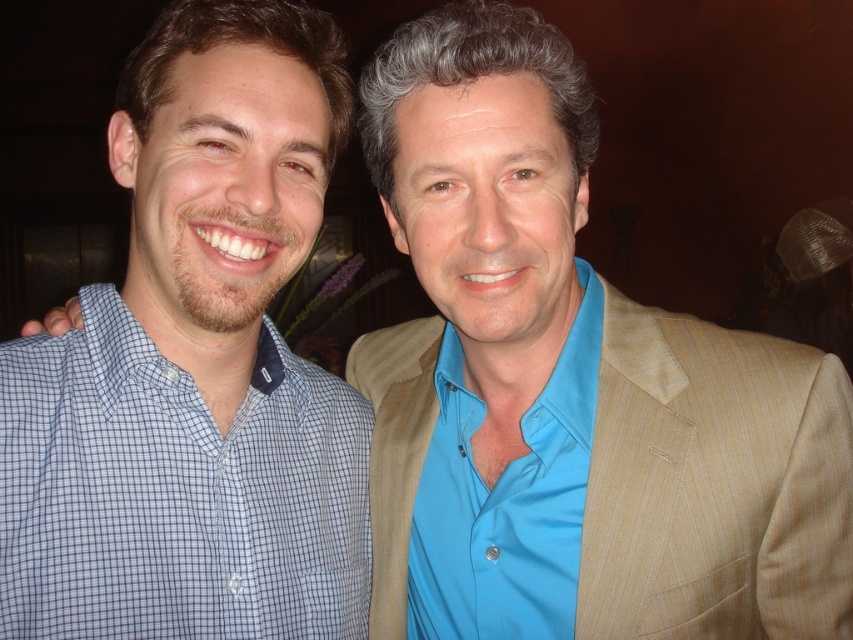
Question: Which object is farther from the camera taking this photo?

Choices:
 (A) blue checkered shirt at left
 (B) blue satin shirt at center

Answer: (B)

Question: Is blue checkered shirt at left below blue satin shirt at center?

Choices:
 (A) yes
 (B) no

Answer: (A)

Question: In this image, where is blue checkered shirt at left located relative to blue satin shirt at center?

Choices:
 (A) below
 (B) above

Answer: (A)

Question: Does blue checkered shirt at left appear on the left side of blue satin shirt at center?

Choices:
 (A) no
 (B) yes

Answer: (B)